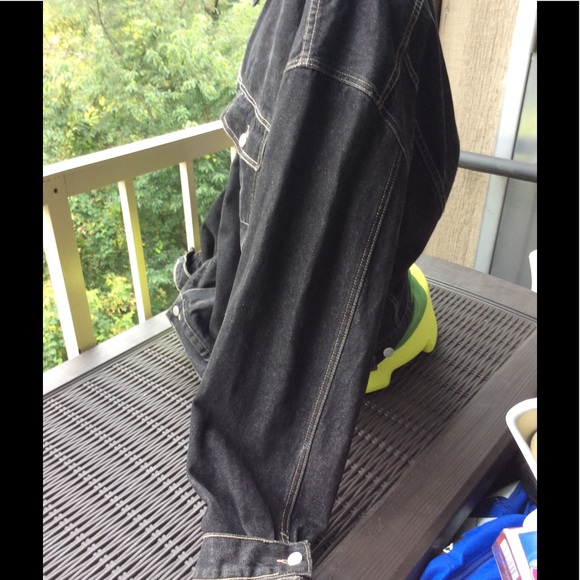
Where is `bowl`? The width and height of the screenshot is (580, 580). bowl is located at coordinates (519, 443).